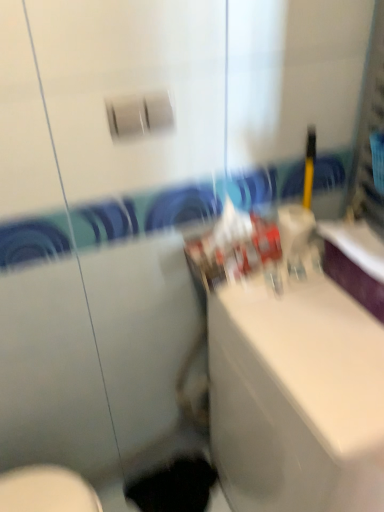
Question: From the image's perspective, is white glossy sink at center above or below black matte hole at lower center?

Choices:
 (A) below
 (B) above

Answer: (B)

Question: Is white glossy sink at center in front of or behind black matte hole at lower center in the image?

Choices:
 (A) behind
 (B) front

Answer: (B)

Question: In terms of width, does white glossy sink at center look wider or thinner when compared to black matte hole at lower center?

Choices:
 (A) thin
 (B) wide

Answer: (B)

Question: From the image's perspective, is black matte hole at lower center located above or below white glossy sink at center?

Choices:
 (A) below
 (B) above

Answer: (A)

Question: Is black matte hole at lower center wider or thinner than white glossy sink at center?

Choices:
 (A) wide
 (B) thin

Answer: (B)

Question: In terms of height, does black matte hole at lower center look taller or shorter compared to white glossy sink at center?

Choices:
 (A) tall
 (B) short

Answer: (B)

Question: Is black matte hole at lower center bigger or smaller than white glossy sink at center?

Choices:
 (A) small
 (B) big

Answer: (A)